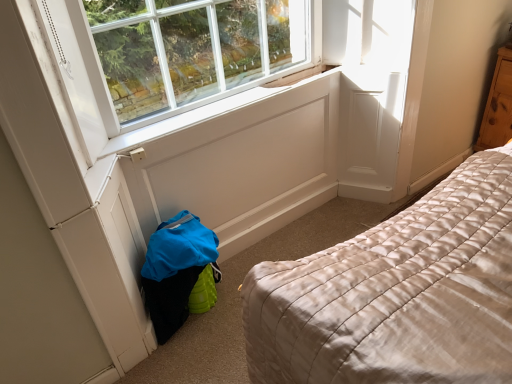
Question: Is wooden dresser at right at the back of white painted wood at center?

Choices:
 (A) yes
 (B) no

Answer: (B)

Question: Are white painted wood at center and wooden dresser at right beside each other?

Choices:
 (A) yes
 (B) no

Answer: (B)

Question: From a real-world perspective, is white painted wood at center physically below wooden dresser at right?

Choices:
 (A) yes
 (B) no

Answer: (B)

Question: Is white painted wood at center wider than wooden dresser at right?

Choices:
 (A) yes
 (B) no

Answer: (B)

Question: Could you tell me if white painted wood at center is turned towards wooden dresser at right?

Choices:
 (A) no
 (B) yes

Answer: (A)

Question: From a real-world perspective, is white painted wood at center on top of wooden dresser at right?

Choices:
 (A) no
 (B) yes

Answer: (B)

Question: Does wooden dresser at right contain white painted wood at center?

Choices:
 (A) yes
 (B) no

Answer: (B)

Question: Is wooden dresser at right at the right side of white painted wood at center?

Choices:
 (A) yes
 (B) no

Answer: (A)

Question: Is wooden dresser at right far away from white painted wood at center?

Choices:
 (A) yes
 (B) no

Answer: (A)

Question: Considering the relative positions of wooden dresser at right and white painted wood at center in the image provided, is wooden dresser at right to the left of white painted wood at center from the viewer's perspective?

Choices:
 (A) yes
 (B) no

Answer: (B)

Question: Can you confirm if wooden dresser at right is shorter than white painted wood at center?

Choices:
 (A) yes
 (B) no

Answer: (B)

Question: Can you confirm if wooden dresser at right is smaller than white painted wood at center?

Choices:
 (A) yes
 (B) no

Answer: (B)

Question: Is wooden dresser at right taller or shorter than white painted wood at center?

Choices:
 (A) tall
 (B) short

Answer: (A)